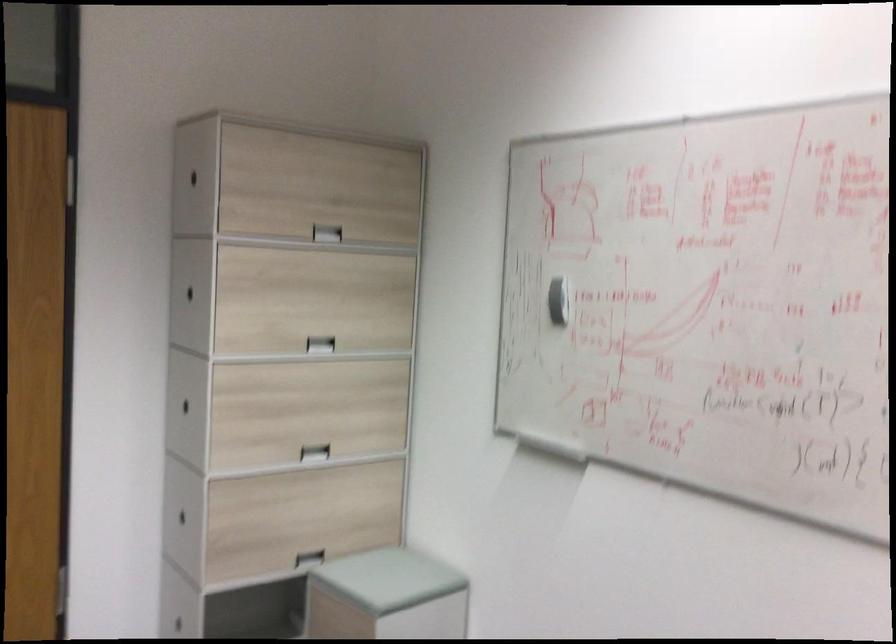
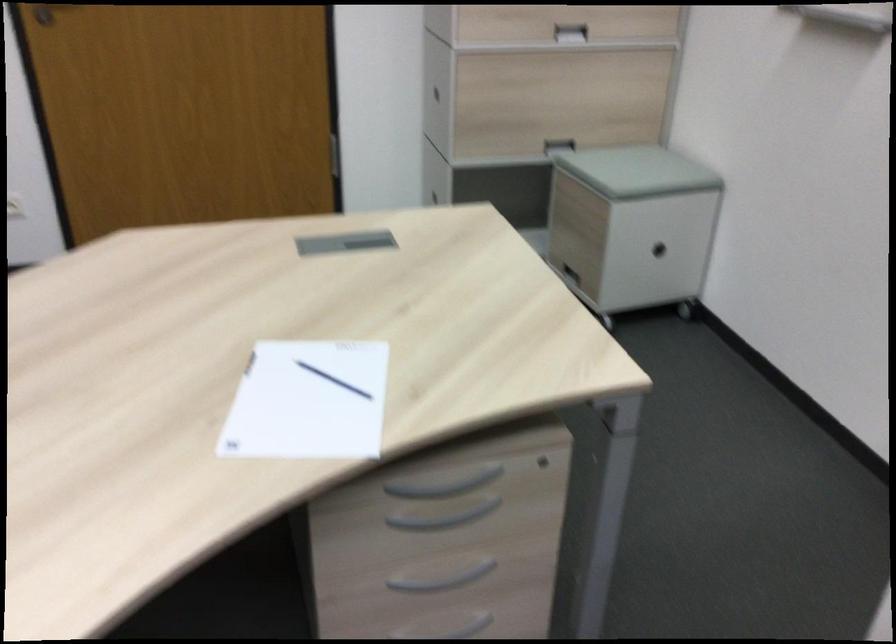
First-person continuous shooting, in which direction is the camera rotating?

The camera's rotation is toward left-down.